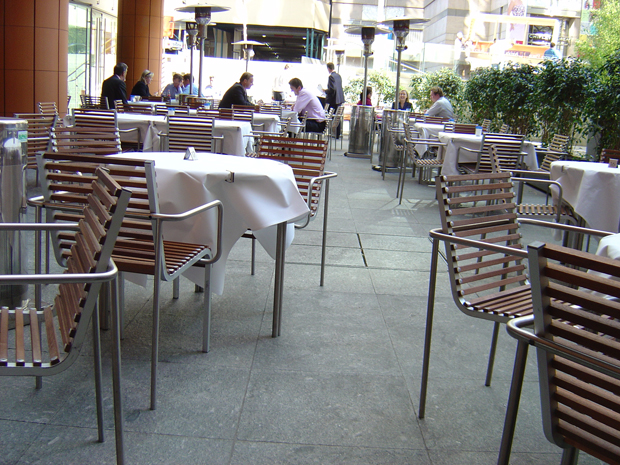
What are the coordinates of `empty dining table` in the screenshot? It's located at (428, 127), (267, 117), (143, 116), (184, 170), (465, 137), (583, 178), (613, 245).